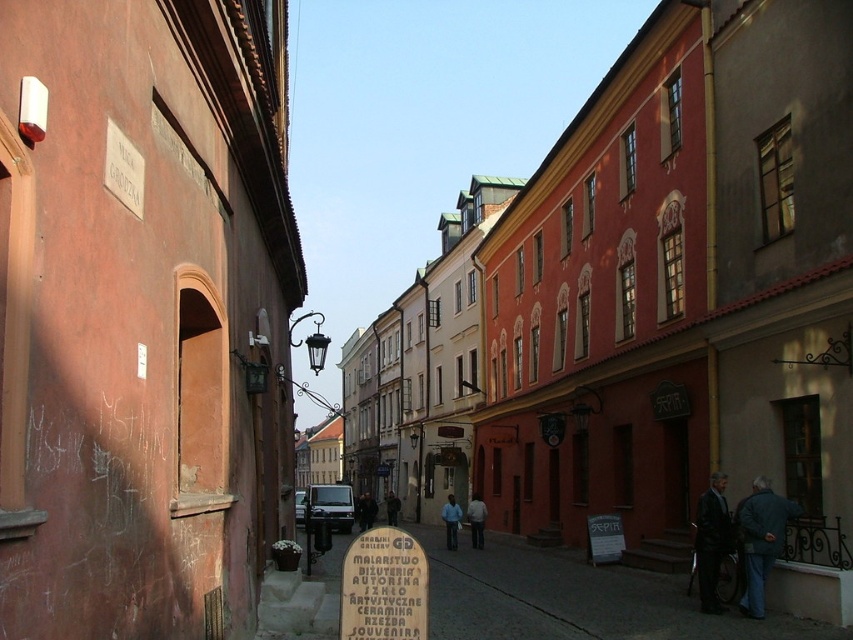
Is point (384, 611) in front of point (363, 522)?

Yes, it is in front of point (363, 522).

In the scene shown: Who is positioned more to the left, wooden signboard at center or dark blue jacket at center?

Positioned to the left is dark blue jacket at center.

Locate an element on the screen. The width and height of the screenshot is (853, 640). wooden signboard at center is located at coordinates (383, 588).

Is point (677, 625) closer to viewer compared to point (395, 524)?

That is True.

Who is more distant from viewer, (613,595) or (393,525)?

Point (393,525)

Is point (619, 564) closer to viewer compared to point (392, 500)?

Yes, point (619, 564) is closer to viewer.

I want to click on stone signboard at center, so click(x=573, y=600).

I want to click on dark gray leather jacket at lower right, so click(712, 541).

Measure the distance between point (717,561) and camera.

13.72 meters

The image size is (853, 640). I want to click on dark gray leather jacket at lower right, so click(712, 541).